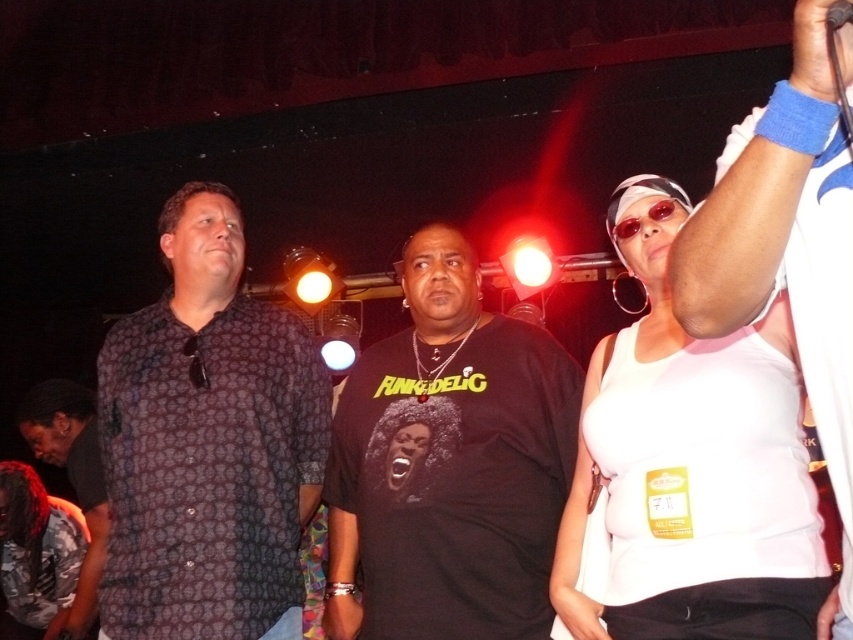
Describe the element at coordinates (450, 465) in the screenshot. The width and height of the screenshot is (853, 640). I see `black matte shirt at center` at that location.

Consider the image. Who is more forward, (366, 448) or (842, 3)?

Point (842, 3) is more forward.

Identify the location of black matte shirt at center. The height and width of the screenshot is (640, 853). (450, 465).

How distant is white matte tank top at upper right from dark gray patterned shirt at lower left?

The distance of white matte tank top at upper right from dark gray patterned shirt at lower left is 1.55 meters.

From the picture: Is white matte tank top at upper right to the left of dark gray patterned shirt at lower left from the viewer's perspective?

No, white matte tank top at upper right is not to the left of dark gray patterned shirt at lower left.

Who is more forward, [741,388] or [38,456]?

Point [741,388]

This screenshot has height=640, width=853. What are the coordinates of `white matte tank top at upper right` in the screenshot? It's located at (648, 378).

Can you confirm if patterned fabric shirt at left is positioned above black matte shirt at center?

Correct, patterned fabric shirt at left is located above black matte shirt at center.

Who is positioned more to the right, patterned fabric shirt at left or black matte shirt at center?

Positioned to the right is black matte shirt at center.

Does point (173, 384) lie behind point (515, 548)?

Yes, it is behind point (515, 548).

You are a GUI agent. You are given a task and a screenshot of the screen. Output one action in this format:
    pyautogui.click(x=<x>, y=<y>)
    Task: Click on the patterned fabric shirt at left
    The image size is (853, 640).
    Given the screenshot: What is the action you would take?
    pyautogui.click(x=207, y=444)